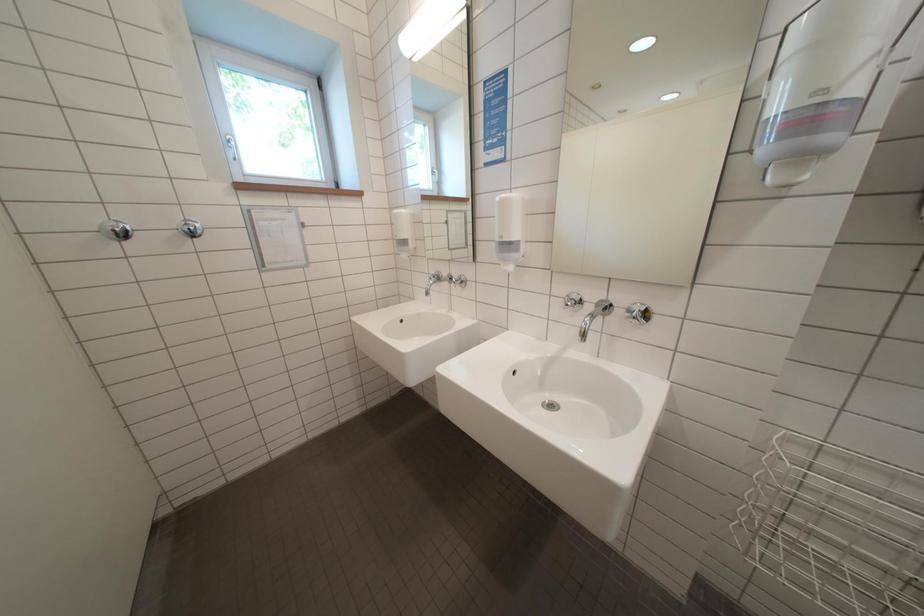
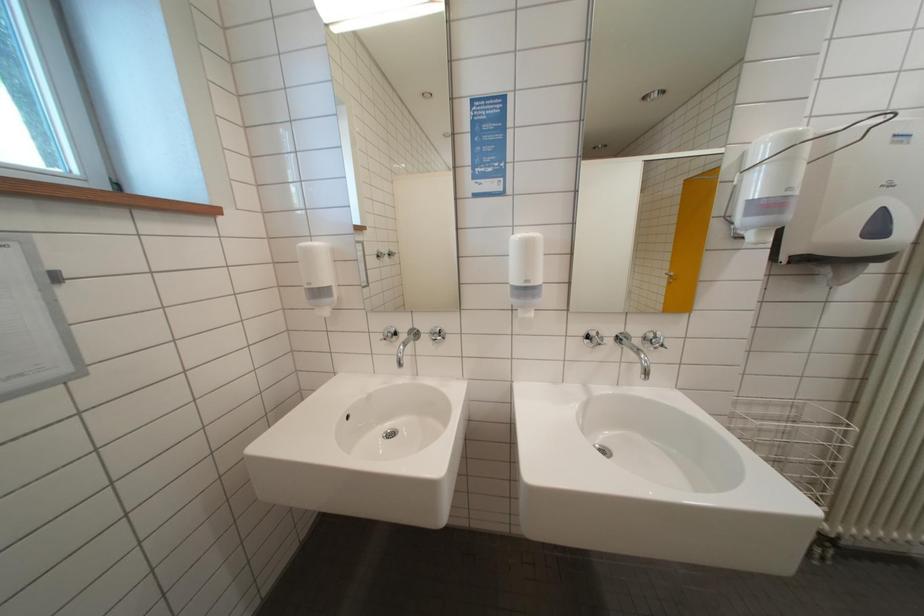
Question: Based on the continuous images, in which direction is the camera rotating? Reply with the corresponding letter.

Choices:
 (A) Left
 (B) Right
 (C) Up
 (D) Down

Answer: (B)